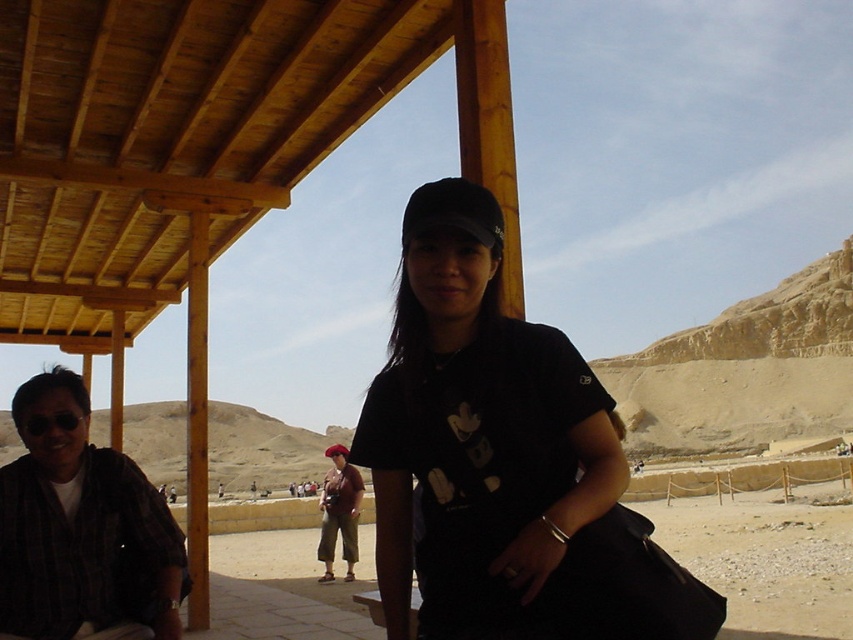
Question: Is wooden canopy at upper left further to the viewer compared to red fabric beret at center?

Choices:
 (A) no
 (B) yes

Answer: (A)

Question: Does wooden canopy at upper left have a greater width compared to plaid shirt at left?

Choices:
 (A) no
 (B) yes

Answer: (B)

Question: Estimate the real-world distances between objects in this image. Which object is farther from the wooden canopy at upper left?

Choices:
 (A) matte black camera at center
 (B) plaid shirt at left
 (C) red fabric beret at center
 (D) black matte shirt at center

Answer: (A)

Question: Can you confirm if wooden canopy at upper left is positioned above black matte shirt at center?

Choices:
 (A) no
 (B) yes

Answer: (B)

Question: Considering the real-world distances, which object is farthest from the black matte shirt at center?

Choices:
 (A) red fabric beret at center
 (B) plaid shirt at left
 (C) matte black camera at center
 (D) wooden canopy at upper left

Answer: (C)

Question: Which point appears farthest from the camera in this image?

Choices:
 (A) (3, 568)
 (B) (355, 548)
 (C) (299, 486)
 (D) (289, 67)

Answer: (C)